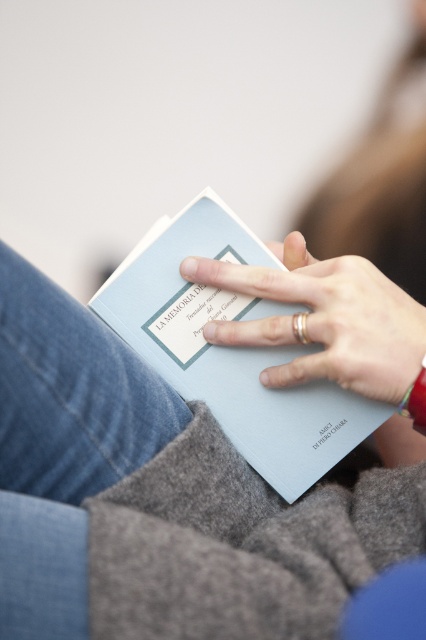
Is point (115, 289) positioned before point (397, 333)?

No, (115, 289) is behind (397, 333).

Describe the element at coordinates (230, 349) in the screenshot. I see `light blue matte paper at center` at that location.

Is point (319, 416) positioned before point (371, 301)?

No, (319, 416) is behind (371, 301).

This screenshot has height=640, width=426. I want to click on light blue matte paper at center, so click(230, 349).